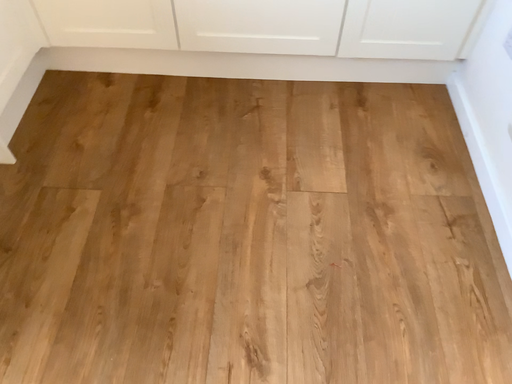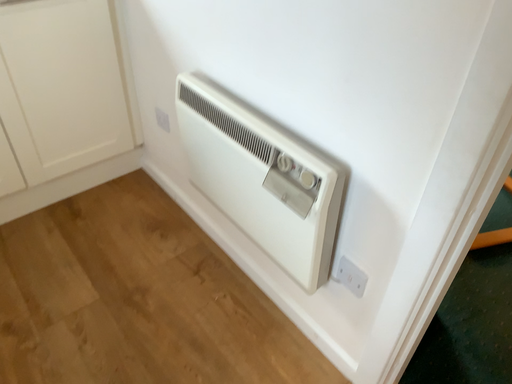
Question: How did the camera likely rotate when shooting the video?

Choices:
 (A) rotated upward
 (B) rotated downward

Answer: (A)